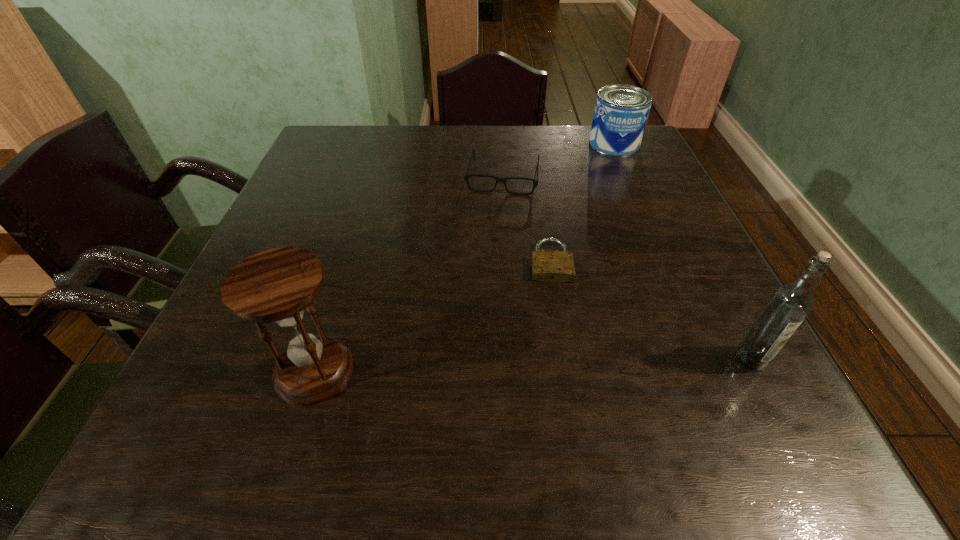
The width and height of the screenshot is (960, 540). I want to click on vacant space situated 0.060m on the keyhole side of the shortest object, so click(x=555, y=306).

Where is `vacant space located on the keyhole side of the shortest object`? Image resolution: width=960 pixels, height=540 pixels. vacant space located on the keyhole side of the shortest object is located at coordinates (561, 363).

Find the location of a particular element. free space located on the front label of the farthest object is located at coordinates (590, 202).

Where is `free region located on the front label of the farthest object`? Image resolution: width=960 pixels, height=540 pixels. free region located on the front label of the farthest object is located at coordinates (587, 212).

I want to click on vacant space located 0.070m on the front label of the farthest object, so click(605, 168).

Identify the location of free location located on the front-facing side of the spectacles. [x=490, y=252].

The image size is (960, 540). Identify the location of free space located on the front-facing side of the spectacles. (492, 240).

Where is `free location located 0.080m on the front-facing side of the spectacles`? free location located 0.080m on the front-facing side of the spectacles is located at coordinates (496, 215).

I want to click on can located at the far edge, so click(621, 111).

Locate an element on the screen. The width and height of the screenshot is (960, 540). spectacles present at the far edge is located at coordinates (466, 177).